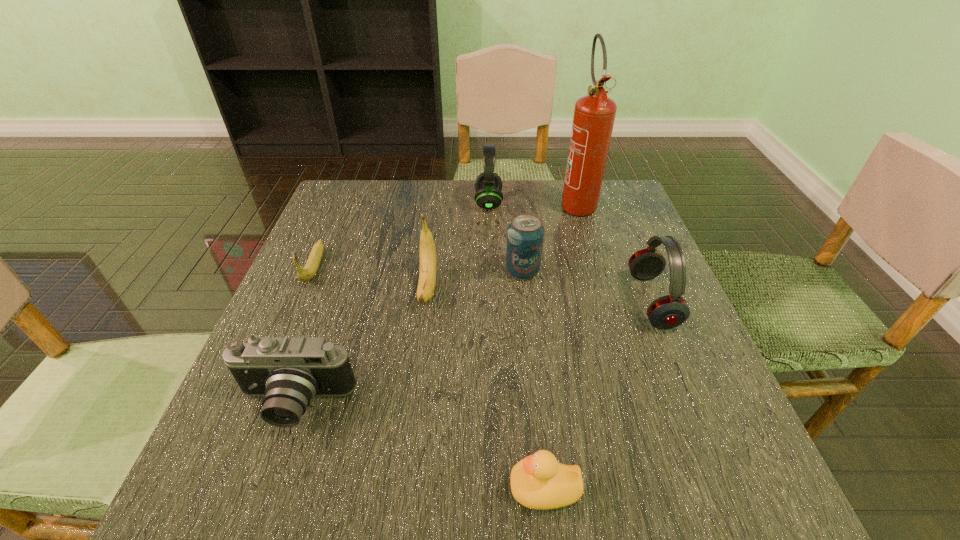
Locate an element on the screen. The width and height of the screenshot is (960, 540). the tallest object is located at coordinates (594, 114).

You are a GUI agent. You are given a task and a screenshot of the screen. Output one action in this format:
    pyautogui.click(x=<x>, y=<y>)
    Task: Click on the seventh object from left to right
    Image resolution: width=960 pixels, height=540 pixels.
    Given the screenshot: What is the action you would take?
    pyautogui.click(x=594, y=114)

At what (x,y) coordinates should I click in order to perform the action: click on headset. Please return your answer as a coordinate pair (x, y). This screenshot has height=540, width=960. Looking at the image, I should click on (488, 185).

Locate an element on the screen. This screenshot has height=540, width=960. the right banana is located at coordinates (427, 251).

You are a GUI agent. You are given a task and a screenshot of the screen. Output one action in this format:
    pyautogui.click(x=<x>, y=<y>)
    Task: Click on the taller banana
    The height and width of the screenshot is (540, 960).
    Given the screenshot: What is the action you would take?
    pyautogui.click(x=427, y=251)

Image resolution: width=960 pixels, height=540 pixels. I want to click on the rightmost object, so click(x=670, y=311).

Find the location of a particular element. This screenshot has height=540, width=960. pop soda is located at coordinates (525, 234).

Where is `camera`? This screenshot has height=540, width=960. camera is located at coordinates (289, 371).

This screenshot has height=540, width=960. I want to click on the shorter banana, so click(308, 272).

At what (x,y) coordinates should I click in order to perform the action: click on duck. Please return your answer as a coordinate pair (x, y). The width and height of the screenshot is (960, 540). Looking at the image, I should click on (538, 481).